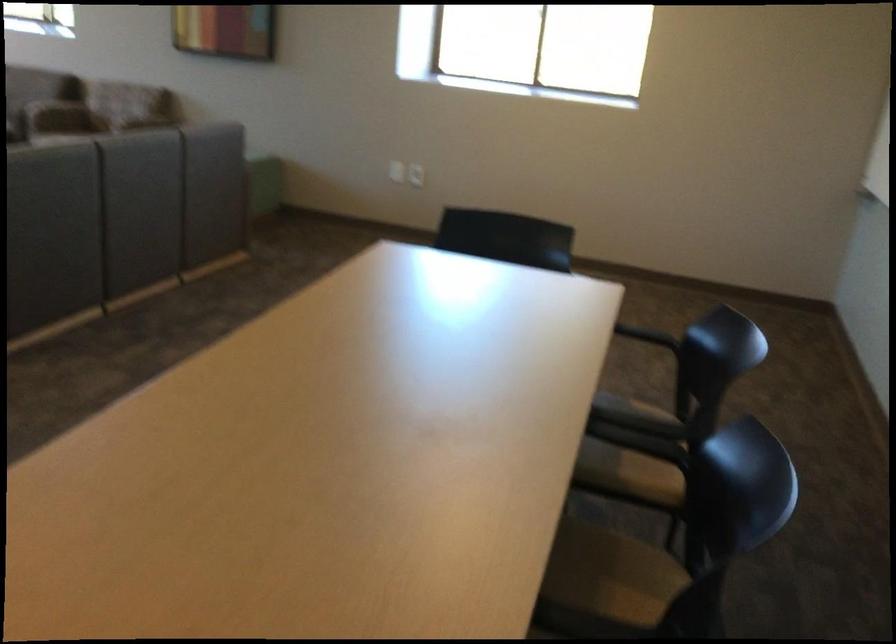
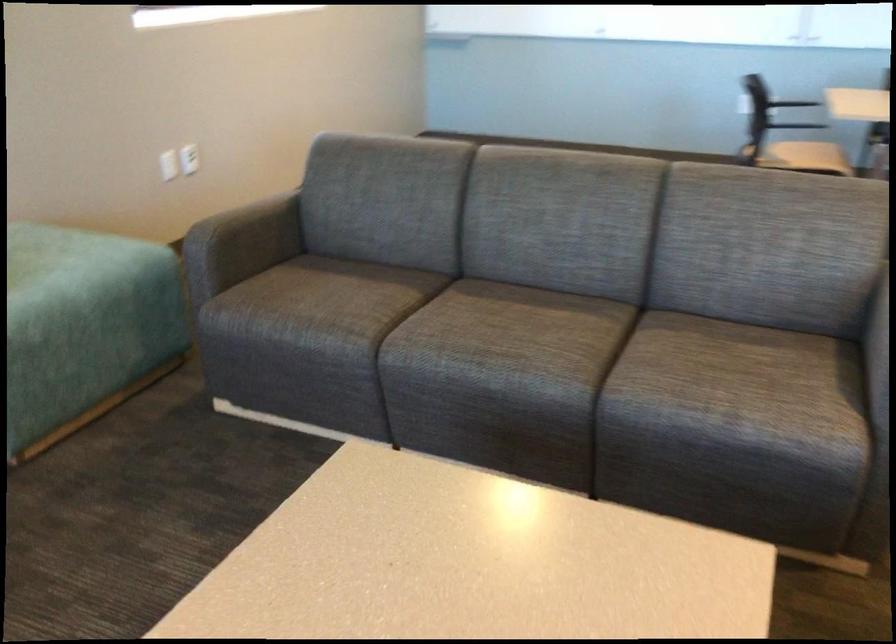
The point at (403,173) is marked in the first image. Where is the corresponding point in the second image?

(168, 165)